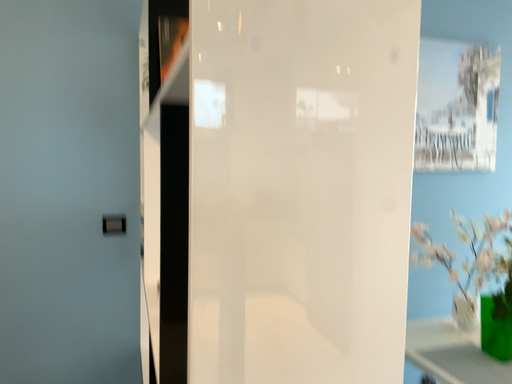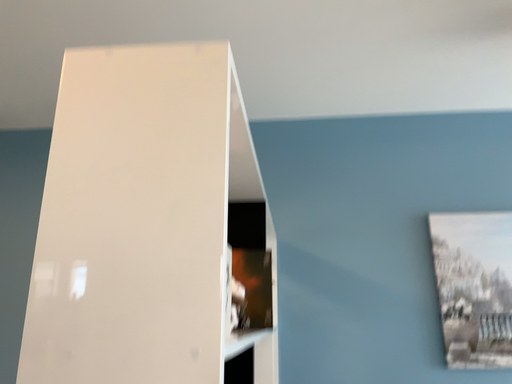
Question: Which way did the camera rotate in the video?

Choices:
 (A) rotated right
 (B) rotated left

Answer: (B)